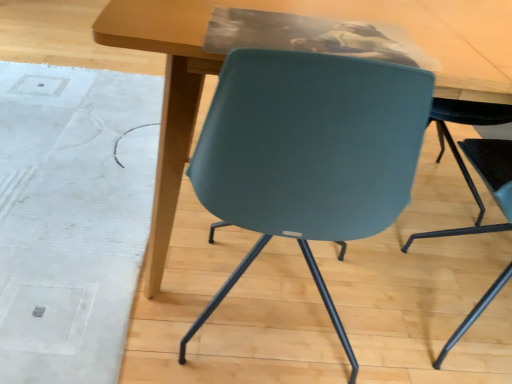
Question: Could you tell me if matte wood table at center is facing white textured mat at lower left?

Choices:
 (A) no
 (B) yes

Answer: (A)

Question: Is matte wood table at center located outside white textured mat at lower left?

Choices:
 (A) no
 (B) yes

Answer: (B)

Question: Is matte wood table at center further to camera compared to white textured mat at lower left?

Choices:
 (A) yes
 (B) no

Answer: (B)

Question: From the image's perspective, would you say matte wood table at center is positioned over white textured mat at lower left?

Choices:
 (A) no
 (B) yes

Answer: (B)

Question: Can you confirm if matte wood table at center is taller than white textured mat at lower left?

Choices:
 (A) no
 (B) yes

Answer: (B)

Question: Visually, is white textured mat at lower left positioned to the left or to the right of teal plastic chair at lower right?

Choices:
 (A) right
 (B) left

Answer: (B)

Question: From the image's perspective, is white textured mat at lower left positioned above or below teal plastic chair at lower right?

Choices:
 (A) above
 (B) below

Answer: (A)

Question: Is white textured mat at lower left taller or shorter than teal plastic chair at lower right?

Choices:
 (A) short
 (B) tall

Answer: (A)

Question: In terms of size, does white textured mat at lower left appear bigger or smaller than teal plastic chair at lower right?

Choices:
 (A) big
 (B) small

Answer: (B)

Question: Is matte wood table at center wider or thinner than white textured mat at lower left?

Choices:
 (A) wide
 (B) thin

Answer: (B)

Question: Visually, is matte wood table at center positioned to the left or to the right of white textured mat at lower left?

Choices:
 (A) right
 (B) left

Answer: (A)

Question: Do you think matte wood table at center is within white textured mat at lower left, or outside of it?

Choices:
 (A) inside
 (B) outside

Answer: (B)

Question: Does point (160, 195) appear closer or farther from the camera than point (117, 195)?

Choices:
 (A) closer
 (B) farther

Answer: (A)

Question: From their relative heights in the image, would you say matte wood table at center is taller or shorter than teal plastic chair at lower right?

Choices:
 (A) tall
 (B) short

Answer: (B)

Question: In the image, is matte wood table at center on the left side or the right side of teal plastic chair at lower right?

Choices:
 (A) right
 (B) left

Answer: (B)